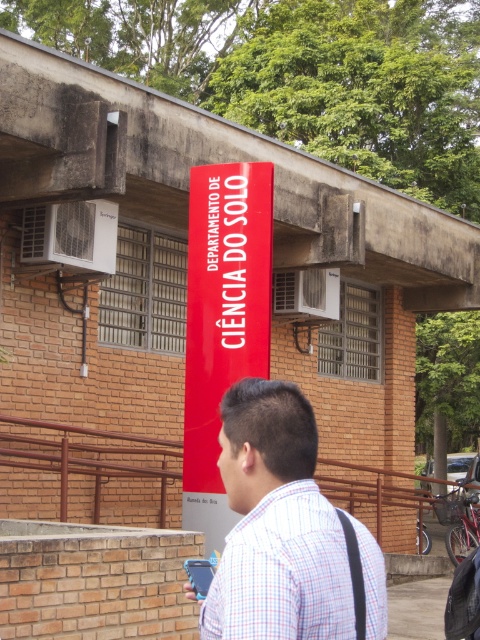
Question: Is plaid shirt at center smaller than matte red sign at center?

Choices:
 (A) yes
 (B) no

Answer: (A)

Question: Which point is closer to the camera?

Choices:
 (A) matte red sign at center
 (B) plaid shirt at center

Answer: (B)

Question: Can you confirm if plaid shirt at center is thinner than matte red sign at center?

Choices:
 (A) yes
 (B) no

Answer: (A)

Question: Does plaid shirt at center have a smaller size compared to matte red sign at center?

Choices:
 (A) yes
 (B) no

Answer: (A)